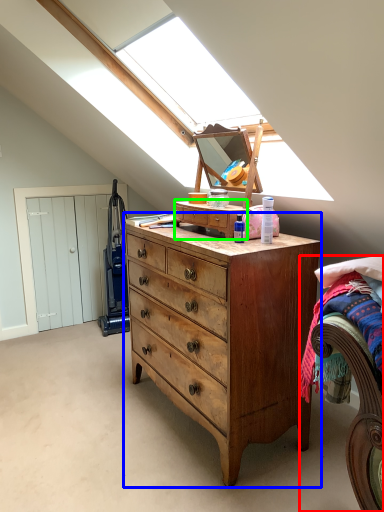
Question: Which object is the closest to the bed (highlighted by a red box)? Choose among these: chest of drawers (highlighted by a blue box) or cabinetry (highlighted by a green box).

Choices:
 (A) chest of drawers
 (B) cabinetry

Answer: (A)